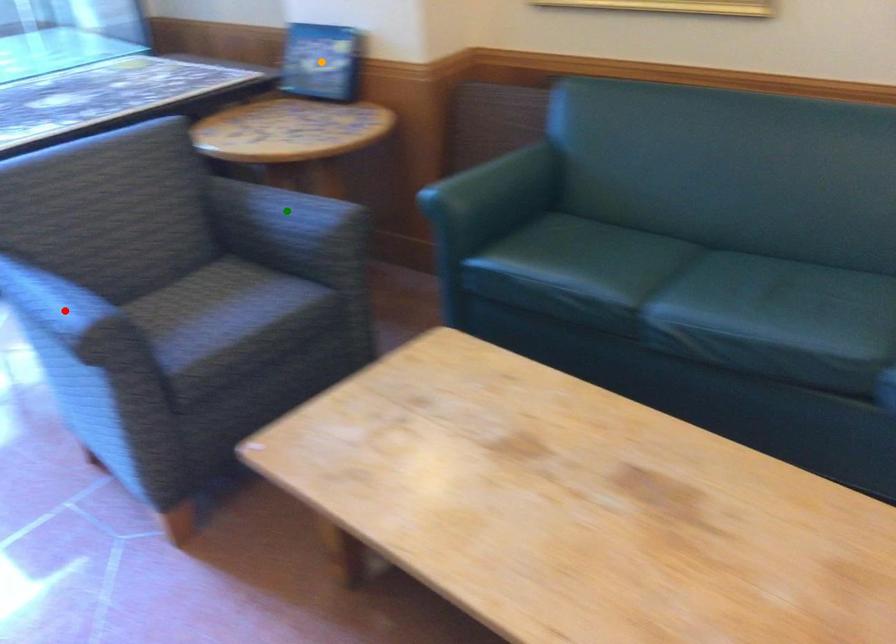
Order these from farthest to nearest:
red point
green point
orange point

orange point
green point
red point